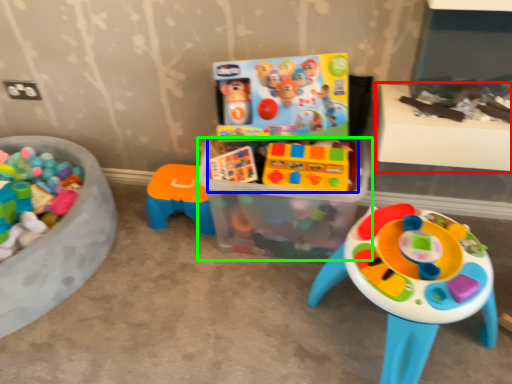
Question: Estimate the real-world distances between objects in this image. Which object is farther from table (highlighted by a red box), toy (highlighted by a blue box) or box (highlighted by a green box)?

Choices:
 (A) toy
 (B) box

Answer: (B)